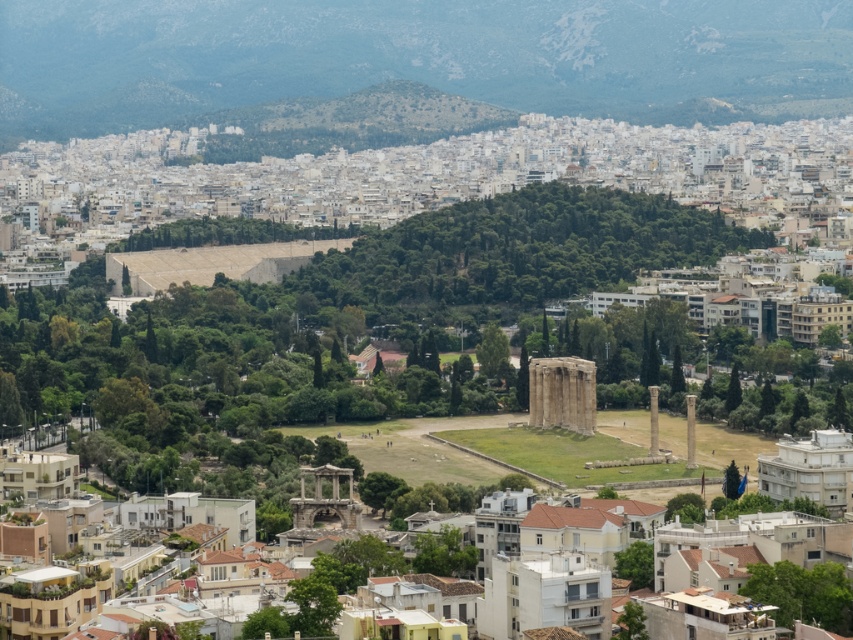
You are a tourist standing in the city square and see the smooth stone column at center and the smooth stone pillar at center. Which one is more to the left?

The smooth stone column at center is more to the left side of the smooth stone pillar at center.

You are an architect planning to place a statue between the smooth stone column at center and the smooth stone pillar at center. The statue requires a space of 1.2 meters in width. Can the space between them accommodate the statue?

The smooth stone column at center is narrower than the smooth stone pillar at center. However, the description does not provide the exact distance between them, only their widths. Therefore, it is impossible to determine if the space between them is sufficient for the statue requiring 1.2 meters in width based on the given information.

You are standing in the cityscape of Athens near the Temple of Olympian Zeus. You see two points marked in the scene. Which point is closer to you, point (650, 394) or point (693, 456)?

Point (650, 394) is closer to you because it is further to the viewer than point (693, 456).